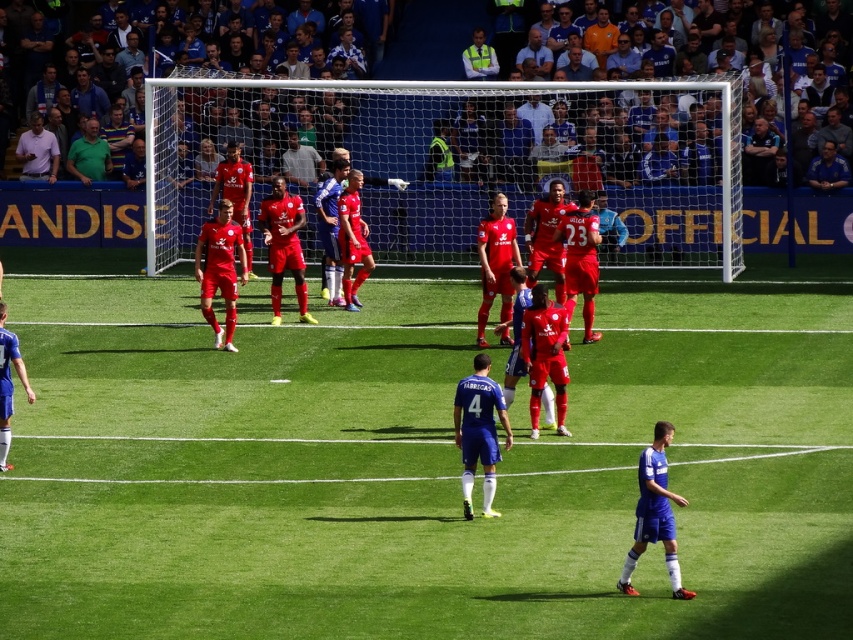
You are a photographer standing at the center of the soccer field and want to take a photo that includes both the point at coordinates point (469, 412) and point (473, 65). Which point will appear larger in the photo?

Point (469, 412) is closer to the camera than point (473, 65), so it will appear larger in the photo.

You are a photographer at the soccer match. You want to take a photo of the shiny red shorts at center and the blue matte jersey at center. Based on their positions, which object should you focus on first to capture both in the frame?

The blue matte jersey at center is to the right of the shiny red shorts at center, so you should focus on the shiny red shorts at center first to ensure both are in the frame.